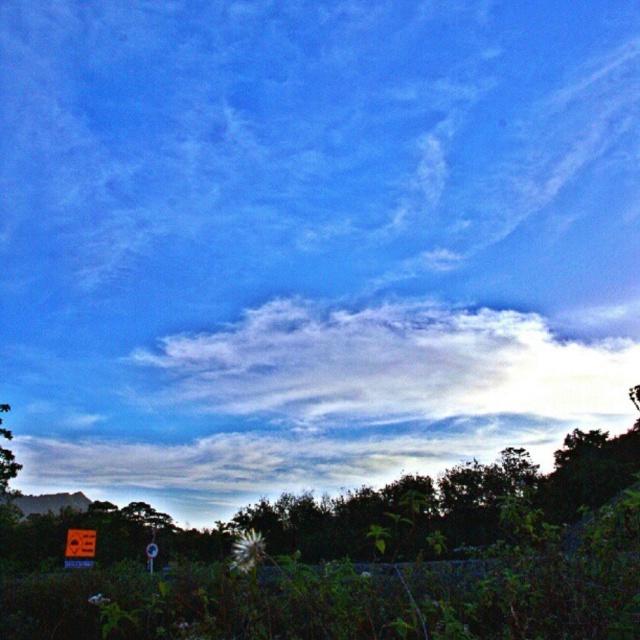
Question: Can you confirm if white fluffy cloud at center is positioned to the left of metallic red sign at bottom left?

Choices:
 (A) no
 (B) yes

Answer: (A)

Question: Which point is farther to the camera?

Choices:
 (A) (72, 538)
 (B) (522, 323)

Answer: (B)

Question: Which point is closer to the camera taking this photo?

Choices:
 (A) (150, 566)
 (B) (516, 337)
 (C) (84, 545)

Answer: (A)

Question: Is white fluffy cloud at center smaller than metallic reflective sign at lower left?

Choices:
 (A) yes
 (B) no

Answer: (B)

Question: Where is white fluffy cloud at center located in relation to metallic red sign at bottom left in the image?

Choices:
 (A) left
 (B) right

Answer: (B)

Question: Based on their relative distances, which object is farther from the metallic reflective sign at lower left?

Choices:
 (A) white fluffy cloud at center
 (B) metallic red sign at bottom left

Answer: (A)